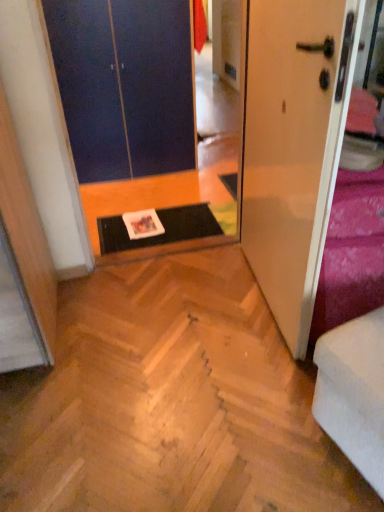
The width and height of the screenshot is (384, 512). Find the location of `vacant area situated below white glossy door at right, the second door positioned from the left (from a real-world perspective)`. vacant area situated below white glossy door at right, the second door positioned from the left (from a real-world perspective) is located at coordinates (262, 301).